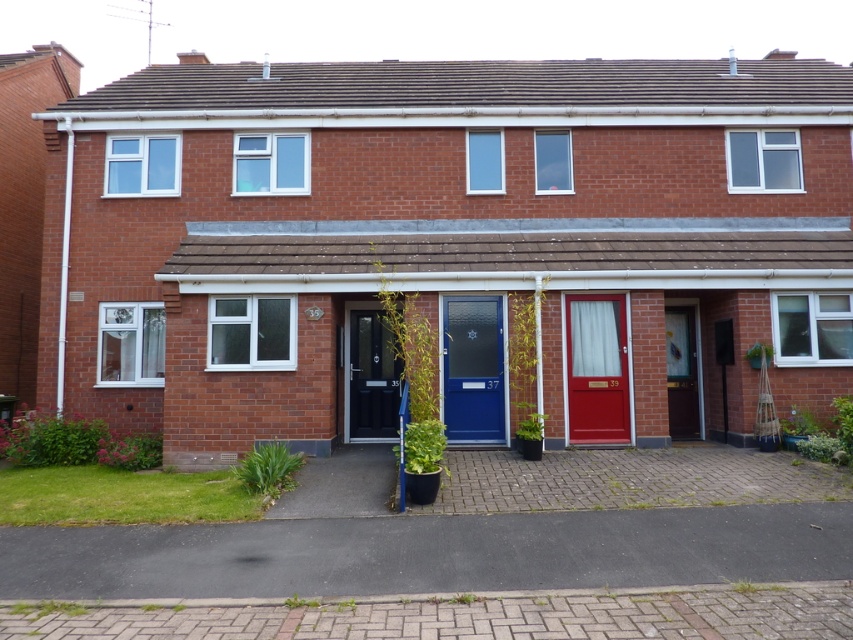
Question: Which object is closer to the camera taking this photo?

Choices:
 (A) matte black door at center
 (B) wooden door at center

Answer: (B)

Question: Does blue glossy door at center appear under matte black door at center?

Choices:
 (A) no
 (B) yes

Answer: (A)

Question: Which point appears farthest from the camera in this image?

Choices:
 (A) (444, 378)
 (B) (671, 403)
 (C) (577, 371)
 (D) (364, 426)

Answer: (D)

Question: Can you confirm if matte red door at center is positioned to the left of matte black door at center?

Choices:
 (A) no
 (B) yes

Answer: (A)

Question: Can you confirm if matte black door at center is thinner than wooden door at center?

Choices:
 (A) yes
 (B) no

Answer: (B)

Question: Which object is positioned farthest from the matte black door at center?

Choices:
 (A) blue glossy door at center
 (B) wooden door at center

Answer: (B)